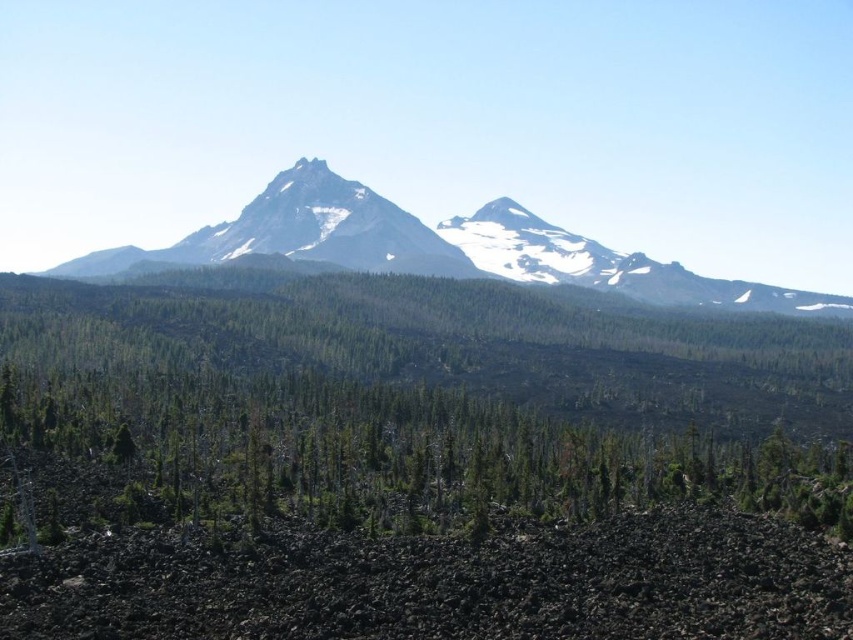
Is green matte tree at center thinner than snowy granite mountain range at center?

Yes.

Between green matte tree at center and snowy granite mountain range at center, which one has less height?

green matte tree at center

Is point (415, 426) farther from viewer compared to point (527, 264)?

That is False.

Find the location of a particular element. green matte tree at center is located at coordinates (422, 401).